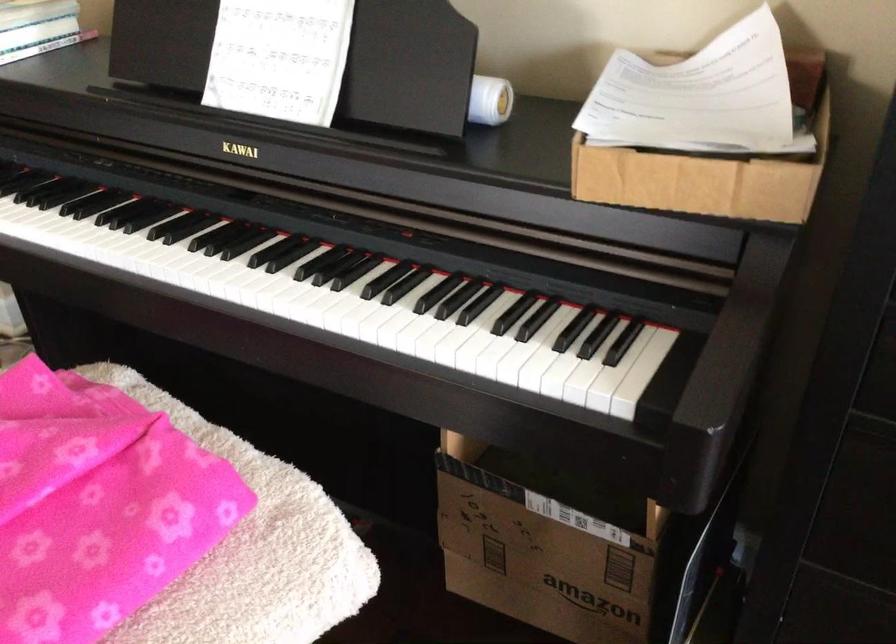
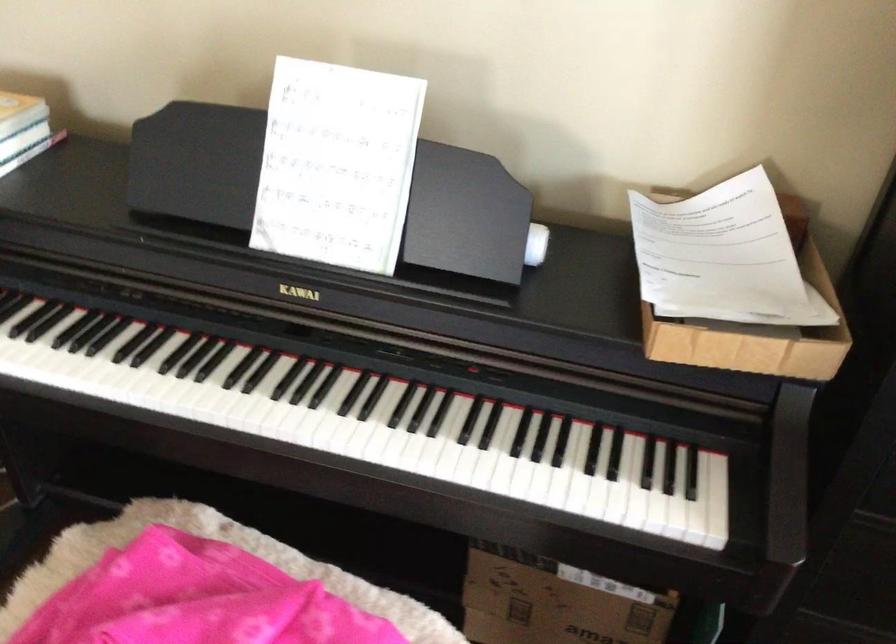
Find the pixel in the second image that matches [489,96] in the first image.

(536, 243)